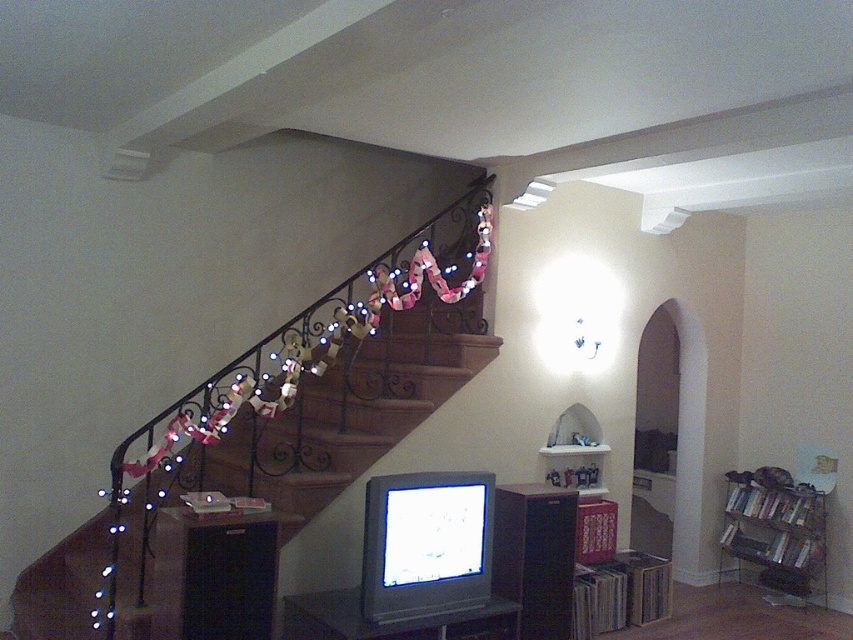
Question: Does wooden stairs at left have a larger size compared to metallic silver bookshelf at lower right?

Choices:
 (A) yes
 (B) no

Answer: (A)

Question: Does wooden stairs at left have a larger size compared to metallic silver bookshelf at lower right?

Choices:
 (A) yes
 (B) no

Answer: (A)

Question: Which point is farther to the camera?

Choices:
 (A) (764, 541)
 (B) (268, 496)

Answer: (A)

Question: Which point is closer to the camera?

Choices:
 (A) (352, 381)
 (B) (762, 580)

Answer: (A)

Question: Is wooden stairs at left bigger than metallic silver bookshelf at lower right?

Choices:
 (A) yes
 (B) no

Answer: (A)